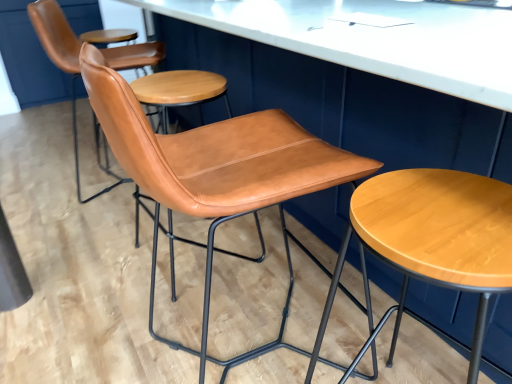
Question: Considering the relative sizes of cognac leather chair at center, marked as the 1th chair in a back-to-front arrangement, and cognac leather chair at center, arranged as the 1th chair when viewed from the front, in the image provided, is cognac leather chair at center, marked as the 1th chair in a back-to-front arrangement, bigger than cognac leather chair at center, arranged as the 1th chair when viewed from the front,?

Choices:
 (A) yes
 (B) no

Answer: (A)

Question: From a real-world perspective, is cognac leather chair at center, marked as the 1th chair in a back-to-front arrangement, physically below cognac leather chair at center, which is counted as the 3th chair, starting from the back?

Choices:
 (A) yes
 (B) no

Answer: (A)

Question: Is cognac leather chair at center, marked as the 1th chair in a back-to-front arrangement, far from cognac leather chair at center, arranged as the 1th chair when viewed from the front?

Choices:
 (A) no
 (B) yes

Answer: (A)

Question: From the image's perspective, is cognac leather chair at center, marked as the 3th chair in a front-to-back arrangement, on cognac leather chair at center, arranged as the 1th chair when viewed from the front?

Choices:
 (A) yes
 (B) no

Answer: (A)

Question: Considering the relative sizes of cognac leather chair at center, marked as the 1th chair in a back-to-front arrangement, and cognac leather chair at center, which is counted as the 3th chair, starting from the back, in the image provided, is cognac leather chair at center, marked as the 1th chair in a back-to-front arrangement, smaller than cognac leather chair at center, which is counted as the 3th chair, starting from the back,?

Choices:
 (A) no
 (B) yes

Answer: (A)

Question: Looking at their shapes, would you say light brown wood stool at center is wider or thinner than cognac leather chair at center, arranged as the 1th chair when viewed from the front?

Choices:
 (A) thin
 (B) wide

Answer: (A)

Question: Is light brown wood stool at center taller or shorter than cognac leather chair at center, arranged as the 1th chair when viewed from the front?

Choices:
 (A) tall
 (B) short

Answer: (B)

Question: In the image, is light brown wood stool at center positioned in front of or behind cognac leather chair at center, arranged as the 1th chair when viewed from the front?

Choices:
 (A) behind
 (B) front

Answer: (B)

Question: From a real-world perspective, is light brown wood stool at center above or below cognac leather chair at center, arranged as the 1th chair when viewed from the front?

Choices:
 (A) above
 (B) below

Answer: (B)

Question: From a real-world perspective, is cognac leather chair at center, the second chair viewed from the front, physically located above or below light brown wood stool at center?

Choices:
 (A) below
 (B) above

Answer: (B)

Question: Is cognac leather chair at center, the 2th chair when ordered from back to front, bigger or smaller than light brown wood stool at center?

Choices:
 (A) small
 (B) big

Answer: (B)

Question: Considering the positions of cognac leather chair at center, the 2th chair when ordered from back to front, and light brown wood stool at center in the image, is cognac leather chair at center, the 2th chair when ordered from back to front, wider or thinner than light brown wood stool at center?

Choices:
 (A) thin
 (B) wide

Answer: (B)

Question: Is cognac leather chair at center, the second chair viewed from the front, inside or outside of light brown wood stool at center?

Choices:
 (A) outside
 (B) inside

Answer: (A)

Question: Considering the positions of cognac leather chair at center, marked as the 1th chair in a back-to-front arrangement, and cognac leather chair at center, the second chair viewed from the front, in the image, is cognac leather chair at center, marked as the 1th chair in a back-to-front arrangement, bigger or smaller than cognac leather chair at center, the second chair viewed from the front,?

Choices:
 (A) small
 (B) big

Answer: (B)

Question: Relative to cognac leather chair at center, the second chair viewed from the front, is cognac leather chair at center, marked as the 1th chair in a back-to-front arrangement, in front or behind?

Choices:
 (A) behind
 (B) front

Answer: (A)